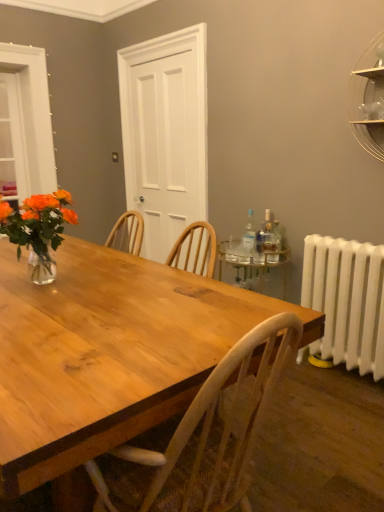
Question: Does transparent plastic bottle at right, which is the 3th bottle in right-to-left order, have a greater height compared to white matte door at center?

Choices:
 (A) no
 (B) yes

Answer: (A)

Question: Could you tell me if transparent plastic bottle at right, which is the 3th bottle in right-to-left order, is facing white matte door at center?

Choices:
 (A) yes
 (B) no

Answer: (B)

Question: From a real-world perspective, is transparent plastic bottle at right, which is the 3th bottle in right-to-left order, located higher than white matte door at center?

Choices:
 (A) yes
 (B) no

Answer: (B)

Question: Is transparent plastic bottle at right, which is the first bottle in left-to-right order, placed right next to white matte door at center?

Choices:
 (A) no
 (B) yes

Answer: (A)

Question: From a real-world perspective, is transparent plastic bottle at right, which is the 3th bottle in right-to-left order, below white matte door at center?

Choices:
 (A) no
 (B) yes

Answer: (B)

Question: Is point tap(306, 270) closer or farther from the camera than point tap(362, 122)?

Choices:
 (A) closer
 (B) farther

Answer: (B)

Question: Which is correct: white painted radiator at right is inside clear glass shelf at upper right, or outside of it?

Choices:
 (A) inside
 (B) outside

Answer: (B)

Question: Based on their sizes in the image, would you say white painted radiator at right is bigger or smaller than clear glass shelf at upper right?

Choices:
 (A) big
 (B) small

Answer: (A)

Question: Is white painted radiator at right in front of or behind clear glass shelf at upper right in the image?

Choices:
 (A) behind
 (B) front

Answer: (A)

Question: From the image's perspective, is white matte door at center above or below transparent plastic bottle at right, which is the 3th bottle in right-to-left order?

Choices:
 (A) above
 (B) below

Answer: (A)

Question: Would you say white matte door at center is inside or outside transparent plastic bottle at right, which is the 3th bottle in right-to-left order?

Choices:
 (A) inside
 (B) outside

Answer: (B)

Question: In terms of height, does white matte door at center look taller or shorter compared to transparent plastic bottle at right, which is the first bottle in left-to-right order?

Choices:
 (A) tall
 (B) short

Answer: (A)

Question: Considering their positions, is white matte door at center located in front of or behind transparent plastic bottle at right, which is the 3th bottle in right-to-left order?

Choices:
 (A) front
 (B) behind

Answer: (B)

Question: In the image, is transparent plastic bottle at right, which is the 3th bottle in right-to-left order, on the left side or the right side of wooden table at center?

Choices:
 (A) right
 (B) left

Answer: (A)

Question: From the image's perspective, relative to wooden table at center, is transparent plastic bottle at right, which is the 3th bottle in right-to-left order, above or below?

Choices:
 (A) above
 (B) below

Answer: (A)